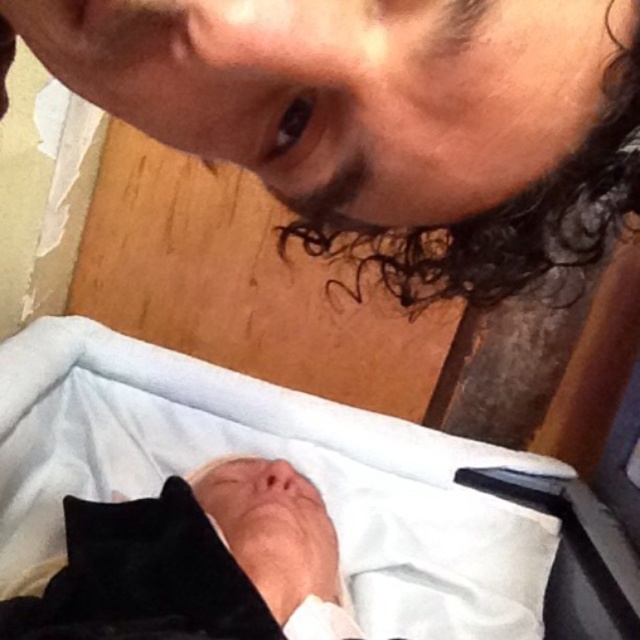
Question: Can you confirm if white fabric infant bed at lower center is smaller than curly dark brown hair at upper center?

Choices:
 (A) no
 (B) yes

Answer: (A)

Question: Which of these objects is positioned closest to the white fabric infant bed at lower center?

Choices:
 (A) black velvet newborn at lower center
 (B) curly dark brown hair at upper center

Answer: (A)

Question: Does black velvet newborn at lower center lie in front of curly dark brown hair at upper center?

Choices:
 (A) yes
 (B) no

Answer: (B)

Question: Among these points, which one is nearest to the camera?

Choices:
 (A) (308, 563)
 (B) (420, 490)

Answer: (A)

Question: Estimate the real-world distances between objects in this image. Which object is closer to the curly dark brown hair at upper center?

Choices:
 (A) black velvet newborn at lower center
 (B) white fabric infant bed at lower center

Answer: (A)

Question: Is black velvet newborn at lower center closer to the viewer compared to curly dark brown hair at upper center?

Choices:
 (A) no
 (B) yes

Answer: (A)